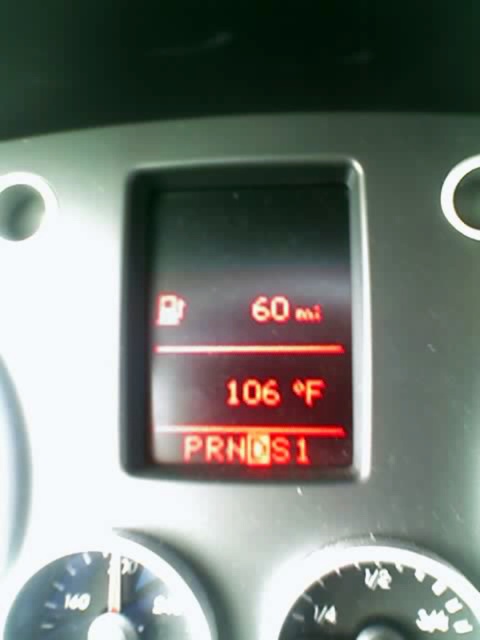
Question: Which object appears closest to the camera in this image?

Choices:
 (A) transparent plastic gauge at lower right
 (B) black glass speedometer at lower left

Answer: (A)

Question: Is black glass speedometer at lower left wider than transparent plastic gauge at lower right?

Choices:
 (A) no
 (B) yes

Answer: (B)

Question: Which of the following is the farthest from the observer?

Choices:
 (A) black glass speedometer at lower left
 (B) transparent plastic gauge at lower right

Answer: (A)

Question: Is black glass speedometer at lower left smaller than transparent plastic gauge at lower right?

Choices:
 (A) no
 (B) yes

Answer: (A)

Question: Which point is closer to the camera?

Choices:
 (A) (158, 628)
 (B) (292, 632)

Answer: (B)

Question: Is the position of black glass speedometer at lower left more distant than that of transparent plastic gauge at lower right?

Choices:
 (A) yes
 (B) no

Answer: (A)